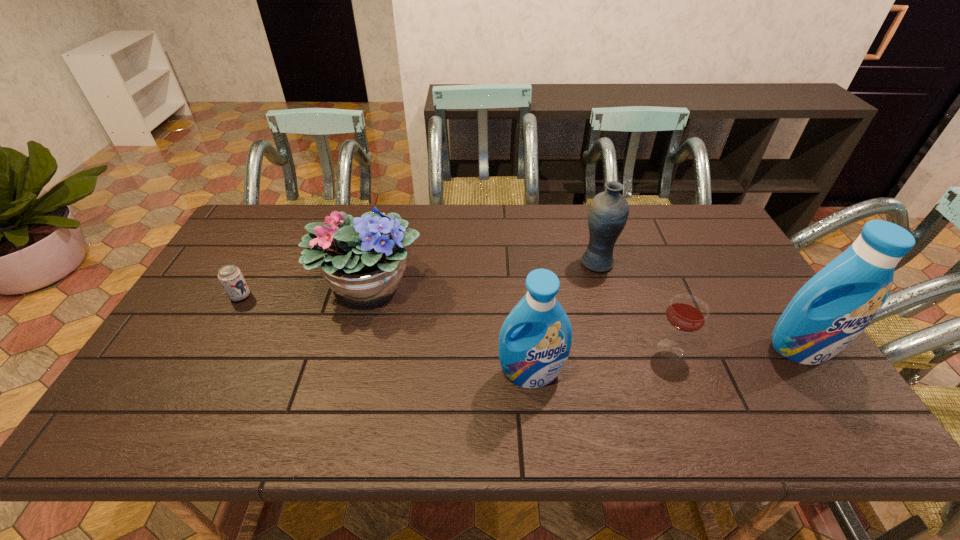
I want to click on free point that keeps the detergents evenly spaced on the left, so [x=230, y=401].